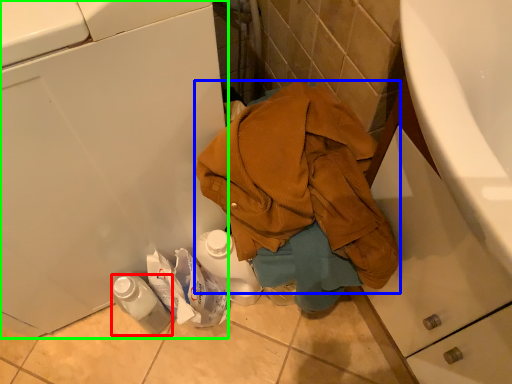
Question: Considering the real-world distances, which object is closest to bottle (highlighted by a red box)? waste (highlighted by a blue box) or washing machine (highlighted by a green box).

Choices:
 (A) waste
 (B) washing machine

Answer: (B)